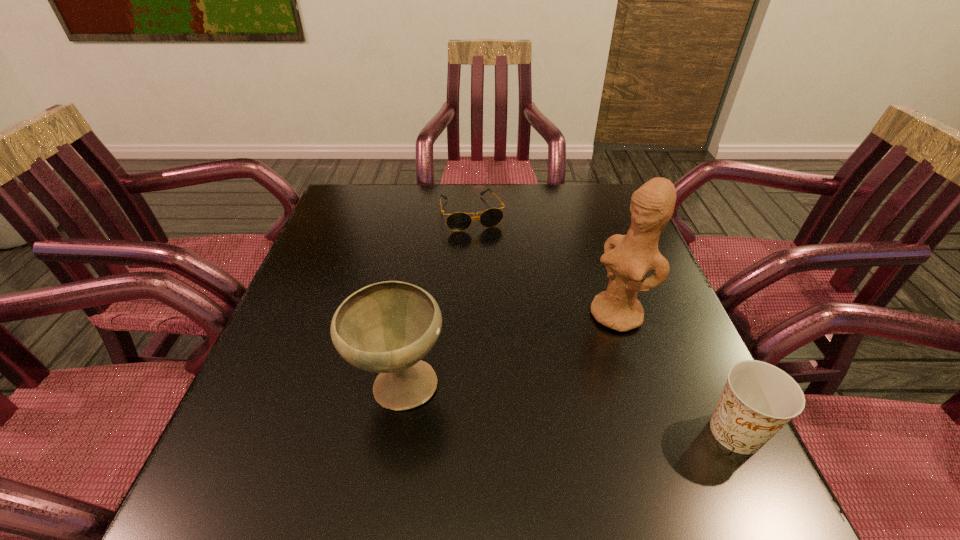
This screenshot has width=960, height=540. In order to click on object that is at the near right corner in this screenshot , I will do `click(759, 399)`.

In the image, there is a desktop. At what (x,y) coordinates should I click in order to perform the action: click on free space at the far edge. Please return your answer as a coordinate pair (x, y). The image size is (960, 540). Looking at the image, I should click on (417, 201).

In the image, there is a desktop. What are the coordinates of `vacant space at the left edge` in the screenshot? It's located at (278, 358).

In order to click on free space at the right edge of the desktop in this screenshot , I will do `click(711, 390)`.

This screenshot has width=960, height=540. Identify the location of free space at the far left corner of the desktop. (363, 188).

Locate an element on the screen. vacant space at the far right corner is located at coordinates point(603,223).

Locate an element on the screen. The width and height of the screenshot is (960, 540). vacant space at the near right corner is located at coordinates click(690, 423).

Locate an element on the screen. Image resolution: width=960 pixels, height=540 pixels. vacant area that lies between the second shortest object and the figurine is located at coordinates (676, 374).

At what (x,y) coordinates should I click in order to perform the action: click on vacant area that lies between the third shortest object and the Dixie cup. Please return your answer as a coordinate pair (x, y). Image resolution: width=960 pixels, height=540 pixels. Looking at the image, I should click on [x=567, y=409].

At what (x,y) coordinates should I click in order to perform the action: click on free spot between the tallest object and the farthest object. Please return your answer as a coordinate pair (x, y). The height and width of the screenshot is (540, 960). Looking at the image, I should click on (543, 264).